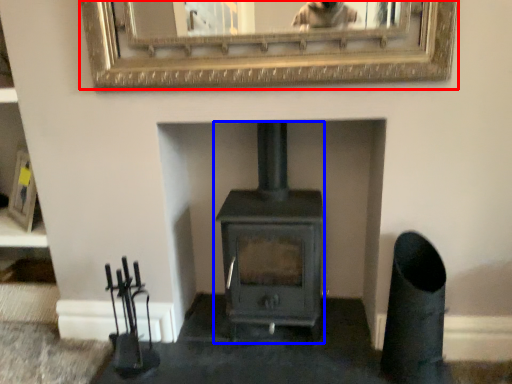
Question: Which object appears closest to the camera in this image, picture frame (highlighted by a red box) or wood burning stove (highlighted by a blue box)?

Choices:
 (A) picture frame
 (B) wood burning stove

Answer: (A)